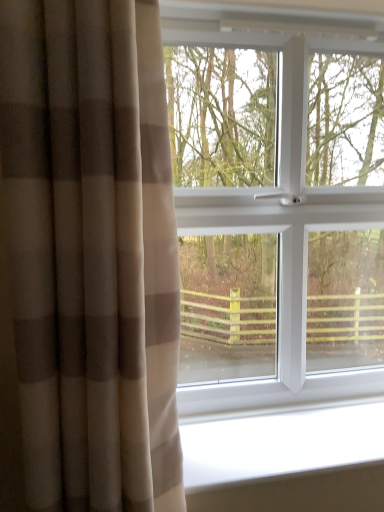
Question: Can you confirm if white smooth window sill at lower center is smaller than white plastic window at center?

Choices:
 (A) no
 (B) yes

Answer: (B)

Question: From the image's perspective, is white smooth window sill at lower center located above white plastic window at center?

Choices:
 (A) no
 (B) yes

Answer: (A)

Question: Is white smooth window sill at lower center not inside white plastic window at center?

Choices:
 (A) no
 (B) yes

Answer: (B)

Question: Is white smooth window sill at lower center next to white plastic window at center and touching it?

Choices:
 (A) yes
 (B) no

Answer: (B)

Question: From a real-world perspective, is white smooth window sill at lower center located beneath white plastic window at center?

Choices:
 (A) yes
 (B) no

Answer: (A)

Question: Looking at their shapes, would you say white plastic window at center is wider or thinner than white smooth window sill at lower center?

Choices:
 (A) thin
 (B) wide

Answer: (A)

Question: Does point (314, 45) appear closer or farther from the camera than point (218, 455)?

Choices:
 (A) closer
 (B) farther

Answer: (B)

Question: Is white plastic window at center bigger or smaller than white smooth window sill at lower center?

Choices:
 (A) small
 (B) big

Answer: (B)

Question: Considering their positions, is white plastic window at center located in front of or behind white smooth window sill at lower center?

Choices:
 (A) behind
 (B) front

Answer: (A)

Question: Considering the positions of point (16, 164) and point (256, 225), is point (16, 164) closer or farther from the camera than point (256, 225)?

Choices:
 (A) closer
 (B) farther

Answer: (A)

Question: Looking at their shapes, would you say beige textured curtain at left is wider or thinner than white plastic window at center?

Choices:
 (A) thin
 (B) wide

Answer: (B)

Question: From the image's perspective, is beige textured curtain at left positioned above or below white plastic window at center?

Choices:
 (A) below
 (B) above

Answer: (A)

Question: From a real-world perspective, relative to white plastic window at center, is beige textured curtain at left vertically above or below?

Choices:
 (A) below
 (B) above

Answer: (A)

Question: From the image's perspective, relative to beige textured curtain at left, is white smooth window sill at lower center above or below?

Choices:
 (A) above
 (B) below

Answer: (B)

Question: From a real-world perspective, is white smooth window sill at lower center physically located above or below beige textured curtain at left?

Choices:
 (A) below
 (B) above

Answer: (A)